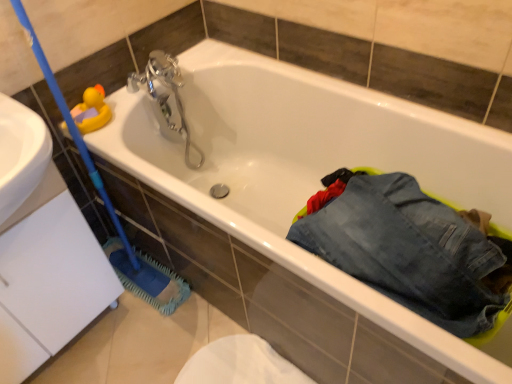
Question: Is denim pants at lower right smaller than silver metallic faucet at upper center?

Choices:
 (A) yes
 (B) no

Answer: (B)

Question: From a real-world perspective, is denim pants at lower right physically above silver metallic faucet at upper center?

Choices:
 (A) yes
 (B) no

Answer: (A)

Question: Does denim pants at lower right lie in front of silver metallic faucet at upper center?

Choices:
 (A) yes
 (B) no

Answer: (A)

Question: From the image's perspective, is denim pants at lower right below silver metallic faucet at upper center?

Choices:
 (A) yes
 (B) no

Answer: (A)

Question: From a real-world perspective, is denim pants at lower right beneath silver metallic faucet at upper center?

Choices:
 (A) yes
 (B) no

Answer: (B)

Question: In terms of width, does blue rubber brush at left look wider or thinner when compared to denim pants at lower right?

Choices:
 (A) thin
 (B) wide

Answer: (A)

Question: Is blue rubber brush at left inside or outside of denim pants at lower right?

Choices:
 (A) inside
 (B) outside

Answer: (B)

Question: From the image's perspective, is blue rubber brush at left above or below denim pants at lower right?

Choices:
 (A) below
 (B) above

Answer: (B)

Question: From their relative heights in the image, would you say blue rubber brush at left is taller or shorter than denim pants at lower right?

Choices:
 (A) short
 (B) tall

Answer: (B)

Question: Considering their positions, is denim pants at lower right located in front of or behind blue rubber brush at left?

Choices:
 (A) behind
 (B) front

Answer: (A)

Question: Based on their sizes in the image, would you say denim pants at lower right is bigger or smaller than blue rubber brush at left?

Choices:
 (A) big
 (B) small

Answer: (B)

Question: From the image's perspective, relative to blue rubber brush at left, is denim pants at lower right above or below?

Choices:
 (A) above
 (B) below

Answer: (B)

Question: From a real-world perspective, relative to blue rubber brush at left, is denim pants at lower right vertically above or below?

Choices:
 (A) below
 (B) above

Answer: (A)

Question: Would you say rubber duck at upper left is to the left or to the right of blue rubber brush at left in the picture?

Choices:
 (A) right
 (B) left

Answer: (B)

Question: From a real-world perspective, relative to blue rubber brush at left, is rubber duck at upper left vertically above or below?

Choices:
 (A) below
 (B) above

Answer: (B)